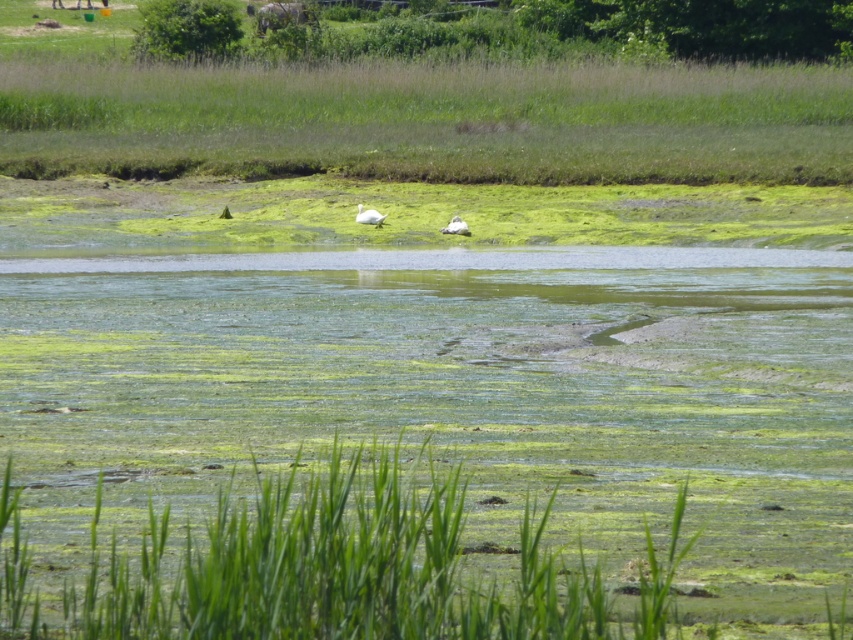
Question: Which of the following is the closest to the observer?

Choices:
 (A) white matte duck at center
 (B) white feathered swan at center
 (C) green leafy grass at lower center
 (D) white feathered bird at upper center

Answer: (C)

Question: Which object is farther from the camera taking this photo?

Choices:
 (A) white matte duck at center
 (B) white feathered swan at center

Answer: (B)

Question: Does white feathered bird at upper center have a greater width compared to white feathered swan at center?

Choices:
 (A) no
 (B) yes

Answer: (B)

Question: Where is white feathered bird at upper center located in relation to white matte duck at center in the image?

Choices:
 (A) below
 (B) above

Answer: (B)

Question: Which is farther from the white feathered swan at center?

Choices:
 (A) white matte duck at center
 (B) white feathered bird at upper center
 (C) green leafy grass at lower center

Answer: (B)

Question: Does green leafy grass at lower center have a greater width compared to white feathered swan at center?

Choices:
 (A) no
 (B) yes

Answer: (B)